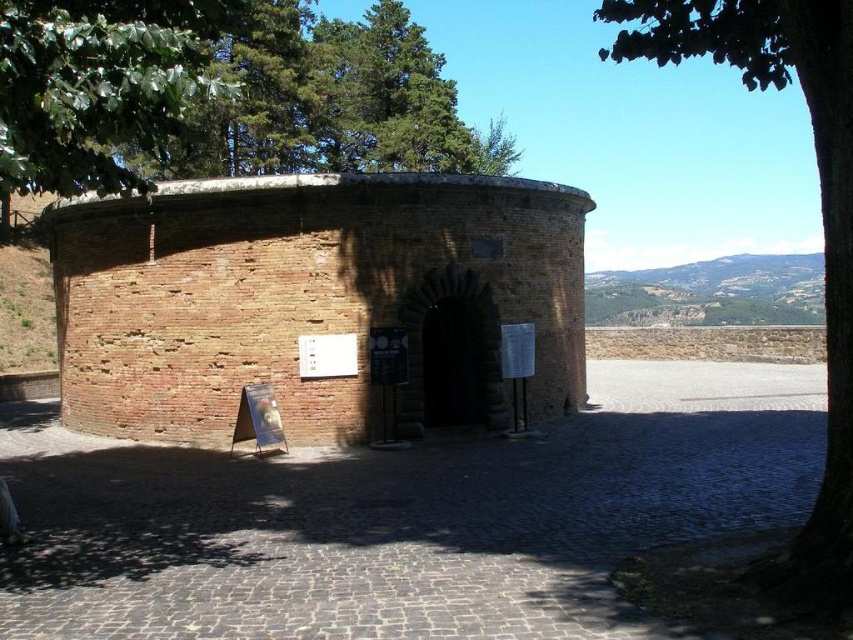
Question: Which point is farther to the camera?

Choices:
 (A) (451, 256)
 (B) (448, 296)
 (C) (62, 186)

Answer: (A)

Question: Does red brick fort at center have a greater width compared to dark brown stone arch at center?

Choices:
 (A) yes
 (B) no

Answer: (A)

Question: Considering the relative positions of green leafy tree at upper right and dark wood door at center in the image provided, where is green leafy tree at upper right located with respect to dark wood door at center?

Choices:
 (A) below
 (B) above

Answer: (B)

Question: Which point is farther to the camera?

Choices:
 (A) (485, 403)
 (B) (123, 336)

Answer: (B)

Question: Which of these objects is positioned closest to the green leafy tree at upper left?

Choices:
 (A) green leafy tree at upper right
 (B) dark brown stone arch at center
 (C) red brick fort at center

Answer: (C)

Question: Does red brick fort at center have a larger size compared to dark wood door at center?

Choices:
 (A) no
 (B) yes

Answer: (B)